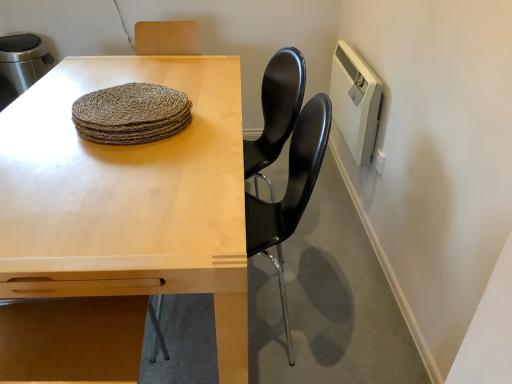
Question: Is black glossy chair at center further to the viewer compared to natural woven placemat at center?

Choices:
 (A) no
 (B) yes

Answer: (A)

Question: Could natural woven placemat at center be considered to be inside black glossy chair at center?

Choices:
 (A) no
 (B) yes

Answer: (A)

Question: From the image's perspective, is black glossy chair at center on natural woven placemat at center?

Choices:
 (A) no
 (B) yes

Answer: (A)

Question: Does black glossy chair at center have a greater height compared to natural woven placemat at center?

Choices:
 (A) yes
 (B) no

Answer: (A)

Question: From the image's perspective, is black glossy chair at center beneath natural woven placemat at center?

Choices:
 (A) no
 (B) yes

Answer: (B)

Question: In the image, is white plastic radiator at upper right on the left side or the right side of light wood table at center?

Choices:
 (A) right
 (B) left

Answer: (A)

Question: Is white plastic radiator at upper right inside the boundaries of light wood table at center, or outside?

Choices:
 (A) outside
 (B) inside

Answer: (A)

Question: From the image's perspective, is white plastic radiator at upper right positioned above or below light wood table at center?

Choices:
 (A) below
 (B) above

Answer: (B)

Question: Looking at the image, does white plastic radiator at upper right seem bigger or smaller compared to light wood table at center?

Choices:
 (A) big
 (B) small

Answer: (B)

Question: Considering the positions of natural woven placemat at center and white plastic radiator at upper right in the image, is natural woven placemat at center bigger or smaller than white plastic radiator at upper right?

Choices:
 (A) small
 (B) big

Answer: (A)

Question: Would you say natural woven placemat at center is inside or outside white plastic radiator at upper right?

Choices:
 (A) outside
 (B) inside

Answer: (A)

Question: Visually, is natural woven placemat at center positioned to the left or to the right of white plastic radiator at upper right?

Choices:
 (A) left
 (B) right

Answer: (A)

Question: In terms of height, does natural woven placemat at center look taller or shorter compared to white plastic radiator at upper right?

Choices:
 (A) short
 (B) tall

Answer: (A)

Question: Is black glossy chair at center taller or shorter than light wood table at center?

Choices:
 (A) short
 (B) tall

Answer: (B)

Question: Which is correct: black glossy chair at center is inside light wood table at center, or outside of it?

Choices:
 (A) outside
 (B) inside

Answer: (B)